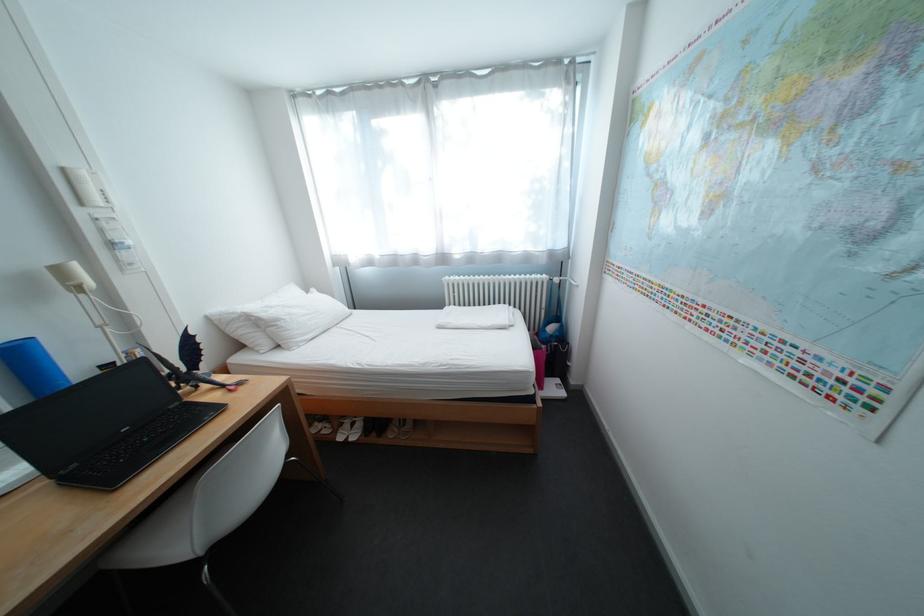
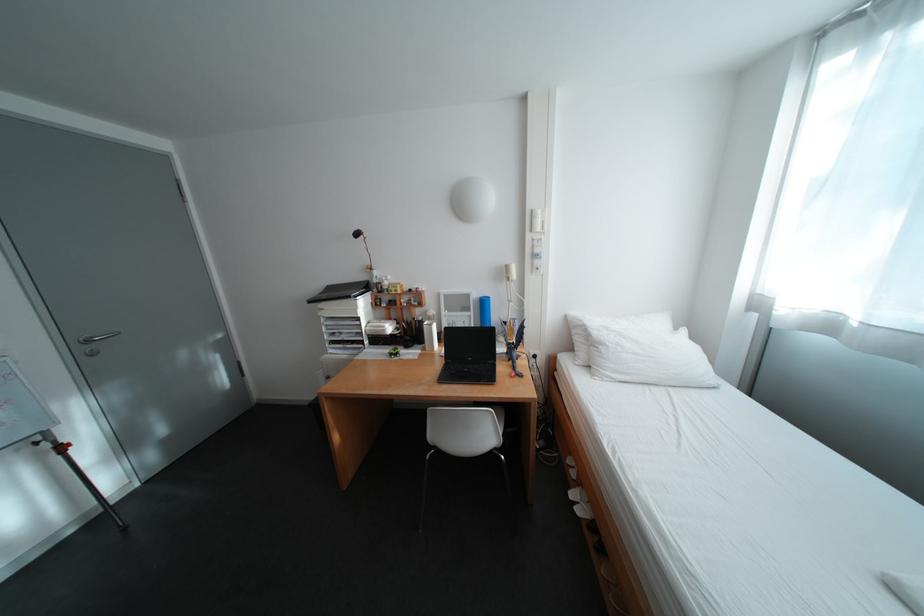
The point at [76,171] is marked in the first image. Where is the corresponding point in the second image?

(544, 213)